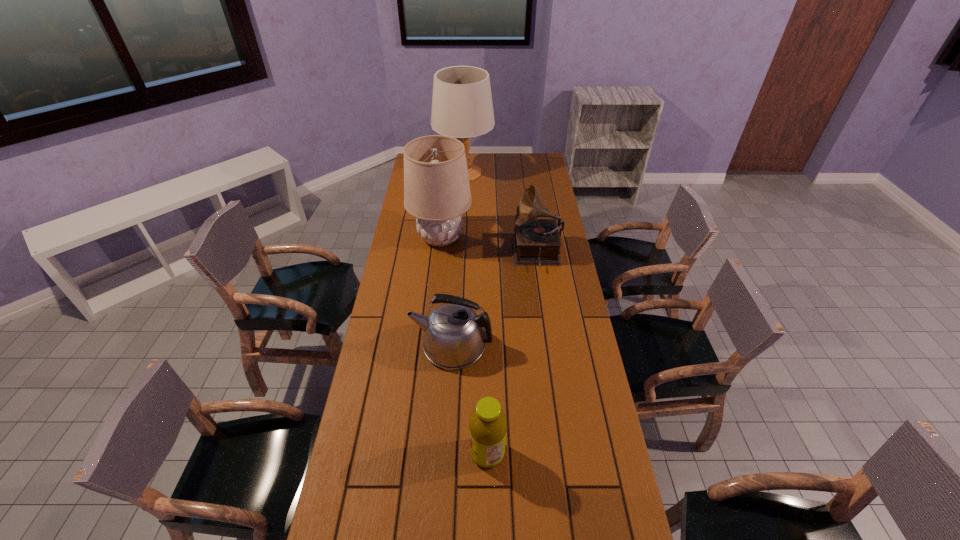
At what (x,y) coordinates should I click in order to perform the action: click on vacant region between the rightmost object and the fruit juice. Please return your answer as a coordinate pair (x, y). This screenshot has height=540, width=960. Looking at the image, I should click on (512, 354).

Image resolution: width=960 pixels, height=540 pixels. Identify the location of free point between the record player and the tallest object. (500, 213).

I want to click on object that is the fourth closest one to the farthest object, so click(x=488, y=424).

Find the location of `object that stands as the closest to the tallest object`. object that stands as the closest to the tallest object is located at coordinates (437, 193).

The height and width of the screenshot is (540, 960). In order to click on vacant space that satisfies the following two spatial constraints: 1. on the front side of the tallest object; 2. on the spout of the kettle in this screenshot , I will do `click(455, 346)`.